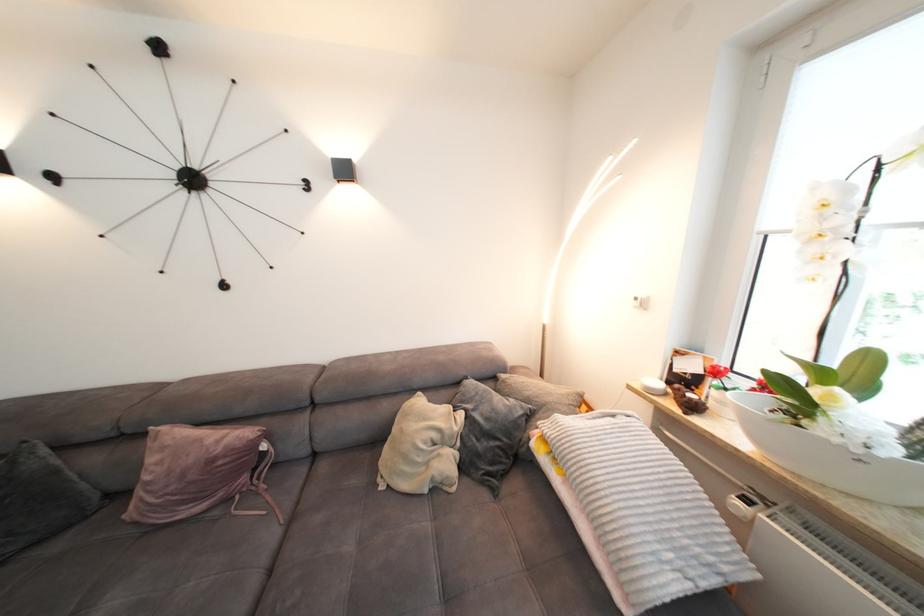
This screenshot has height=616, width=924. What do you see at coordinates (40, 496) in the screenshot?
I see `a dark grey pillow` at bounding box center [40, 496].